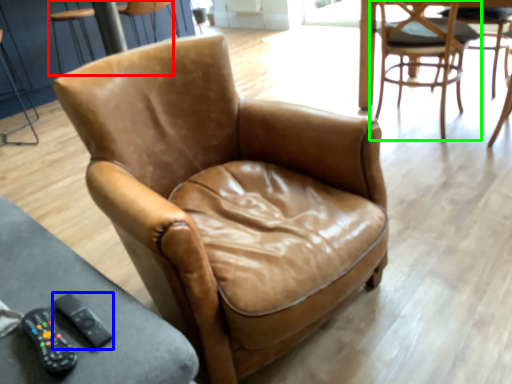
Question: Which object is positioned farthest from chair (highlighted by a red box)? Select from remote (highlighted by a blue box) and chair (highlighted by a green box).

Choices:
 (A) remote
 (B) chair

Answer: (A)